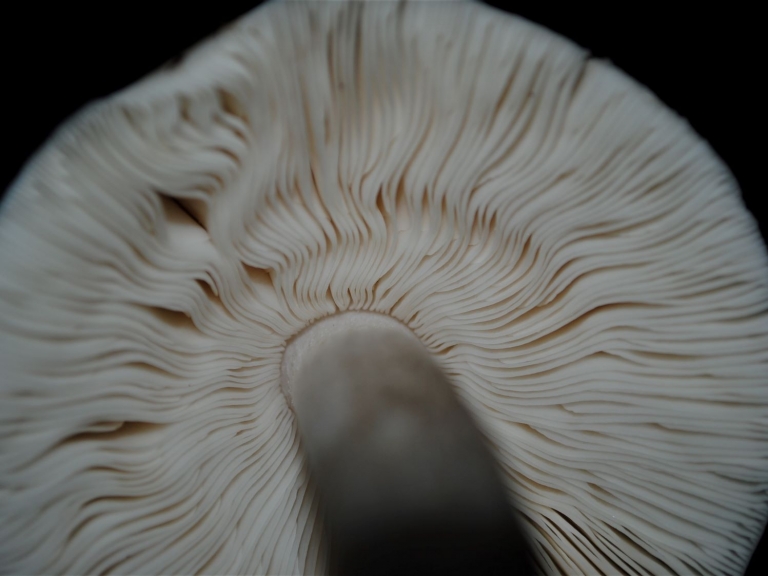
The width and height of the screenshot is (768, 576). Find the location of `potential wet tissues`. potential wet tissues is located at coordinates (381, 137).